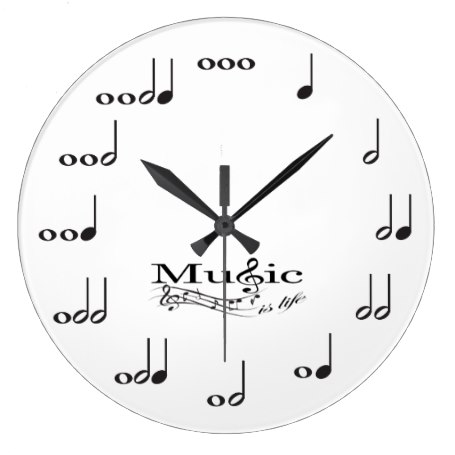
I want to click on clock, so click(239, 184).